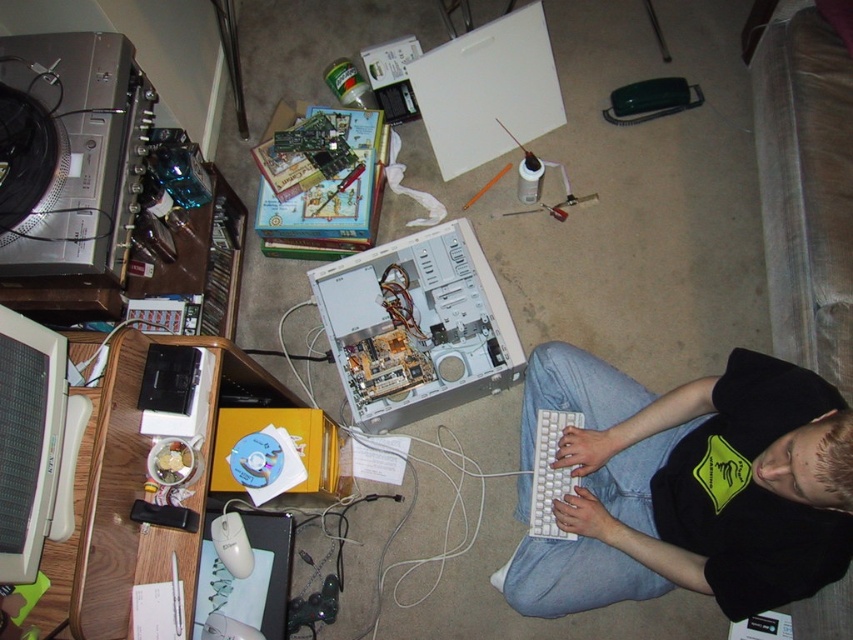
Question: Is white matte keyboard at lower center below white plastic computer case at center?

Choices:
 (A) no
 (B) yes

Answer: (B)

Question: Can you confirm if white matte keyboard at lower center is positioned below white plastic mouse at lower left?

Choices:
 (A) yes
 (B) no

Answer: (B)

Question: From the image, what is the correct spatial relationship of white plastic keyboard at lower center in relation to white plastic mouse at lower left?

Choices:
 (A) below
 (B) above

Answer: (B)

Question: Estimate the real-world distances between objects in this image. Which object is closer to the white plastic mouse at lower left?

Choices:
 (A) white matte mouse at lower left
 (B) white matte keyboard at lower center
 (C) white plastic keyboard at lower center

Answer: (A)

Question: Which point is farther to the camera?

Choices:
 (A) white matte mouse at lower left
 (B) white matte keyboard at lower center
 (C) white plastic mouse at lower left

Answer: (C)

Question: Which point is closer to the camera taking this photo?

Choices:
 (A) (233, 545)
 (B) (439, 243)

Answer: (A)